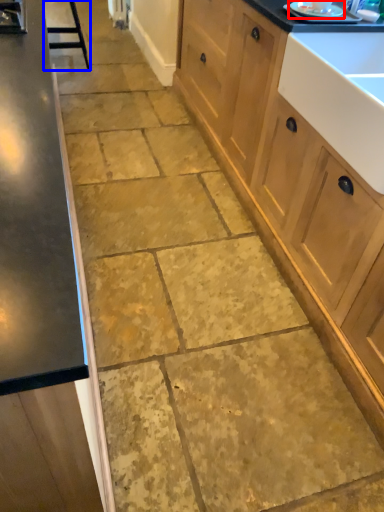
Question: Which object appears closest to the camera in this image, appliance (highlighted by a red box) or bar stool (highlighted by a blue box)?

Choices:
 (A) appliance
 (B) bar stool

Answer: (A)